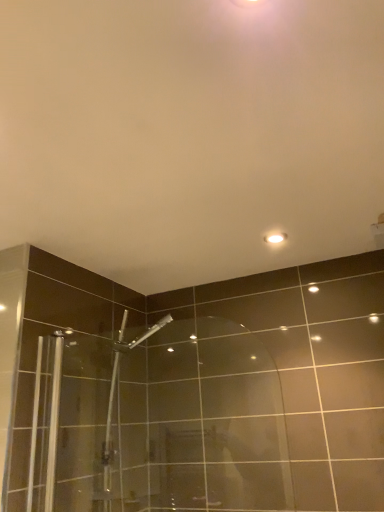
You are a GUI agent. You are given a task and a screenshot of the screen. Output one action in this format:
    pyautogui.click(x=<x>, y=<y>)
    Task: Click on the transparent glass shower door at center
    The image size is (384, 512).
    Given the screenshot: What is the action you would take?
    point(158,423)

This screenshot has width=384, height=512. Describe the element at coordinates (158, 423) in the screenshot. I see `transparent glass shower door at center` at that location.

Where is `white glossy light fixture at upper center`? white glossy light fixture at upper center is located at coordinates (275, 238).

Image resolution: width=384 pixels, height=512 pixels. Describe the element at coordinates (275, 238) in the screenshot. I see `white glossy light fixture at upper center` at that location.

You are a GUI agent. You are given a task and a screenshot of the screen. Output one action in this format:
    pyautogui.click(x=<x>, y=<y>)
    Task: Click on the transparent glass shower door at center
    
    Given the screenshot: What is the action you would take?
    pyautogui.click(x=158, y=423)

Which is more to the left, transparent glass shower door at center or white glossy light fixture at upper center?

From the viewer's perspective, transparent glass shower door at center appears more on the left side.

Which object is closer to the camera taking this photo, transparent glass shower door at center or white glossy light fixture at upper center?

transparent glass shower door at center.

Between point (138, 405) and point (276, 234), which one is positioned in front?

The point (276, 234) is more forward.

From the image's perspective, is transparent glass shower door at center above or below white glossy light fixture at upper center?

Based on their image positions, transparent glass shower door at center is located beneath white glossy light fixture at upper center.

From a real-world perspective, is transparent glass shower door at center over white glossy light fixture at upper center?

No.

Is transparent glass shower door at center wider than white glossy light fixture at upper center?

Incorrect, the width of transparent glass shower door at center does not surpass that of white glossy light fixture at upper center.

Which of these two, transparent glass shower door at center or white glossy light fixture at upper center, stands taller?

With more height is transparent glass shower door at center.

Considering the sizes of objects transparent glass shower door at center and white glossy light fixture at upper center in the image provided, who is smaller, transparent glass shower door at center or white glossy light fixture at upper center?

white glossy light fixture at upper center.

Would you say transparent glass shower door at center is inside or outside white glossy light fixture at upper center?

transparent glass shower door at center is outside white glossy light fixture at upper center.

Does transparent glass shower door at center touch white glossy light fixture at upper center?

No.

Is transparent glass shower door at center looking in the opposite direction of white glossy light fixture at upper center?

No, white glossy light fixture at upper center is not at the back of transparent glass shower door at center.

How different are the orientations of transparent glass shower door at center and white glossy light fixture at upper center in degrees?

0.227 degrees separate the facing orientations of transparent glass shower door at center and white glossy light fixture at upper center.

Measure the distance between transparent glass shower door at center and white glossy light fixture at upper center.

transparent glass shower door at center and white glossy light fixture at upper center are 32.86 inches apart.

The image size is (384, 512). I want to click on shower door that appears below the white glossy light fixture at upper center (from the image's perspective), so click(x=158, y=423).

Between white glossy light fixture at upper center and transparent glass shower door at center, which one appears on the right side from the viewer's perspective?

From the viewer's perspective, white glossy light fixture at upper center appears more on the right side.

Relative to transparent glass shower door at center, is white glossy light fixture at upper center in front or behind?

Visually, white glossy light fixture at upper center is located behind transparent glass shower door at center.

Between point (283, 236) and point (263, 397), which one is positioned behind?

The point (263, 397) is farther from the camera.

Consider the image. From the image's perspective, which is below, white glossy light fixture at upper center or transparent glass shower door at center?

transparent glass shower door at center appears lower in the image.

From a real-world perspective, does white glossy light fixture at upper center sit lower than transparent glass shower door at center?

No, from a real-world perspective, white glossy light fixture at upper center is not under transparent glass shower door at center.

Consider the image. Considering the sizes of objects white glossy light fixture at upper center and transparent glass shower door at center in the image provided, who is wider, white glossy light fixture at upper center or transparent glass shower door at center?

With larger width is white glossy light fixture at upper center.

Does white glossy light fixture at upper center have a greater height compared to transparent glass shower door at center?

No.

Who is smaller, white glossy light fixture at upper center or transparent glass shower door at center?

With smaller size is white glossy light fixture at upper center.

Which is correct: white glossy light fixture at upper center is inside transparent glass shower door at center, or outside of it?

white glossy light fixture at upper center exists outside the volume of transparent glass shower door at center.

Is white glossy light fixture at upper center not near transparent glass shower door at center?

No, there isn't a large distance between white glossy light fixture at upper center and transparent glass shower door at center.

Is white glossy light fixture at upper center positioned with its back to transparent glass shower door at center?

white glossy light fixture at upper center does not have its back to transparent glass shower door at center.

Can you tell me how much white glossy light fixture at upper center and transparent glass shower door at center differ in facing direction?

0.227 degrees separate the facing orientations of white glossy light fixture at upper center and transparent glass shower door at center.

At what (x,y) coordinates should I click in order to perform the action: click on light fixture above the transparent glass shower door at center (from the image's perspective). Please return your answer as a coordinate pair (x, y). Looking at the image, I should click on (275, 238).

You are a GUI agent. You are given a task and a screenshot of the screen. Output one action in this format:
    pyautogui.click(x=<x>, y=<y>)
    Task: Click on the shower door in front of the white glossy light fixture at upper center
    This screenshot has width=384, height=512.
    Given the screenshot: What is the action you would take?
    pyautogui.click(x=158, y=423)

I want to click on light fixture positioned vertically above the transparent glass shower door at center (from a real-world perspective), so click(x=275, y=238).